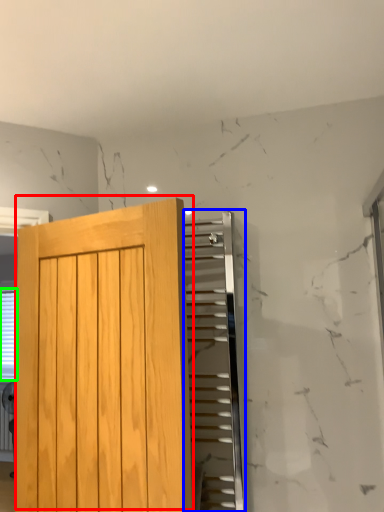
Question: Which is farther away from door (highlighted by a red box)? elevator (highlighted by a blue box) or blind (highlighted by a green box)?

Choices:
 (A) elevator
 (B) blind

Answer: (A)